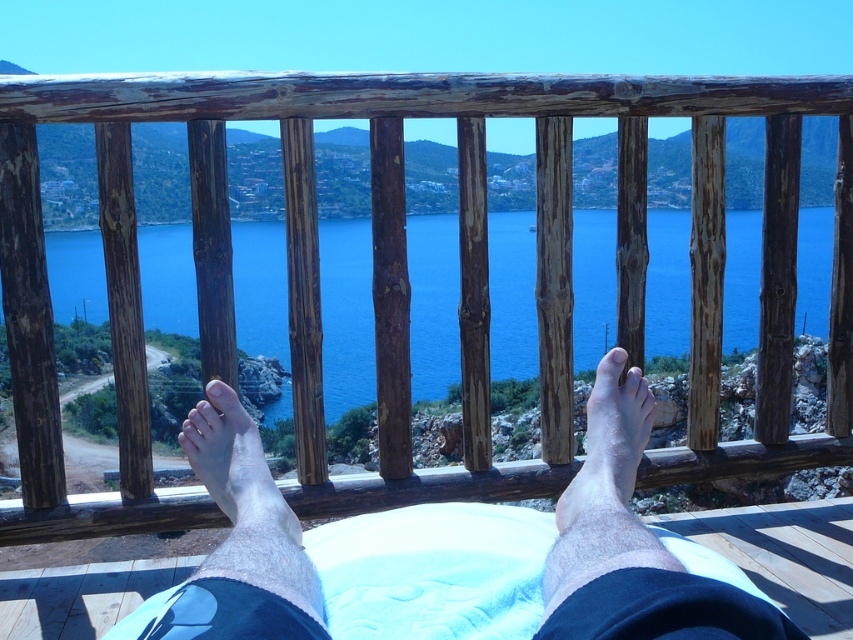
You are standing on the balcony and want to look through the railing to see the ocean. There are two points marked on the railing. Which point, point 1 at coordinates (821, 298) or point 2 at coordinates (625, 376), is closer to you as you stand on the balcony?

Point 2 at coordinates (625, 376) is closer to you because point 1 at coordinates (821, 298) is behind it.

Looking at this image, you are a photographer trying to capture the pale skin at center and the skinny white towel at lower center in a single shot. Can you ensure the towel is visible beneath the pale skin in the photo?

The skinny white towel at lower center is positioned under the pale skin at center, so yes, the towel will be visible beneath the pale skin in the photo.

You are a photographer trying to capture the pale skin at center and the skinny white towel at lower center in a single shot. Based on their positions, which object is closer to the camera?

The pale skin at center is closer to the camera than the skinny white towel at lower center because objects closer to the camera appear larger and the pale skin at center is larger in the image.